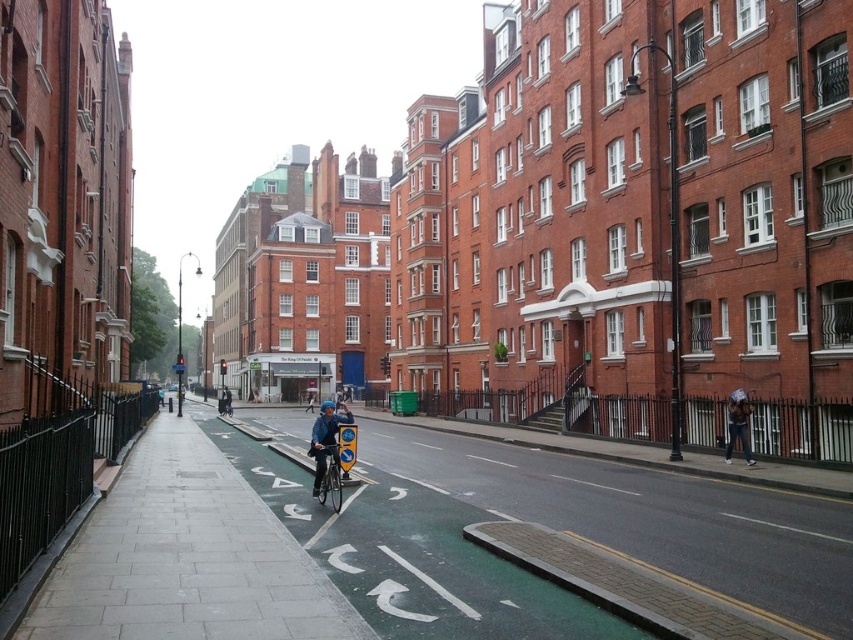
You are a delivery person who needs to place a package on the green rubber bike lane at center. The package is the same size as the blue matte bicycle helmet at center. Will the package fit on the bike lane?

The green rubber bike lane at center has a smaller size compared to the blue matte bicycle helmet at center. Since the package is the same size as the helmet, it will not fit on the bike lane.

You are standing at the point where the cyclist is currently located. You want to move to the point marked at coordinate (328, 474). Is the silver metallic bicycle at center blocking your path?

The silver metallic bicycle at center is located exactly at the point marked at coordinate (328, 474), so it would block your path.

You are a delivery person who needs to secure your blue matte bicycle helmet at center onto your silver metallic bicycle at center. Based on the scene, is the helmet currently positioned in a suitable place for easy access while riding?

The silver metallic bicycle at center is above the blue matte bicycle helmet at center, so the helmet is positioned below the bicycle. This placement makes it easily accessible for the delivery person to reach while riding.